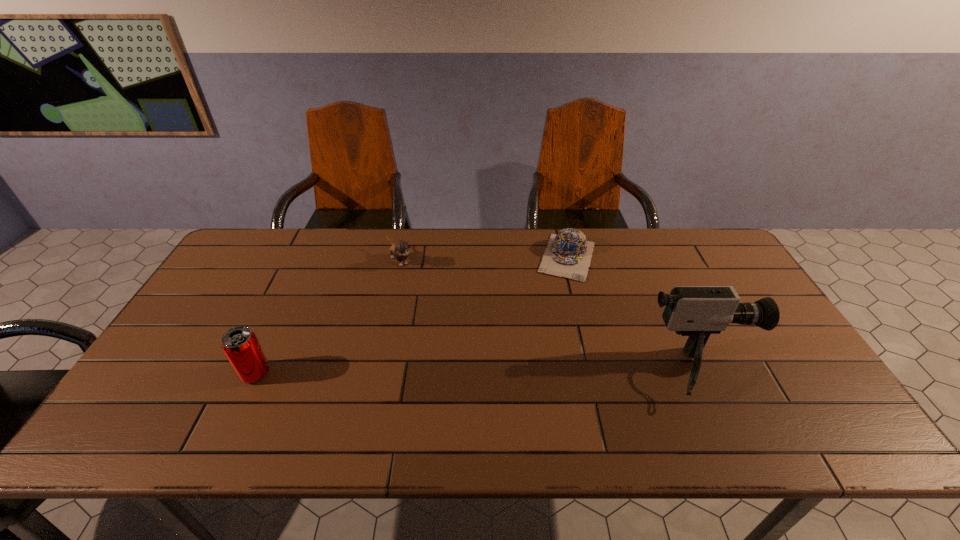
Where is `soda can`? soda can is located at coordinates (240, 345).

Image resolution: width=960 pixels, height=540 pixels. I want to click on the leftmost object, so click(240, 345).

At what (x,y) coordinates should I click in order to perform the action: click on the tallest object. Please return your answer as a coordinate pair (x, y). This screenshot has width=960, height=540. Looking at the image, I should click on (696, 311).

The height and width of the screenshot is (540, 960). Find the location of `camcorder`. camcorder is located at coordinates pos(696,311).

The width and height of the screenshot is (960, 540). I want to click on the second object from left to right, so click(399, 251).

Find the location of a particular element. This screenshot has width=960, height=540. kitten is located at coordinates (399, 251).

Identify the location of the shortest object. This screenshot has width=960, height=540. (568, 255).

Where is `cap`? cap is located at coordinates (568, 255).

You are a GUI agent. You are given a task and a screenshot of the screen. Output one action in this format:
    pyautogui.click(x=<x>, y=<y>)
    Task: Click on the blank space located 0.240m on the back of the leftmost object
    This screenshot has width=960, height=540.
    Given the screenshot: What is the action you would take?
    pyautogui.click(x=291, y=297)

Image resolution: width=960 pixels, height=540 pixels. What are the coordinates of `free spot located on the recording direction of the tallest object` in the screenshot? It's located at (797, 373).